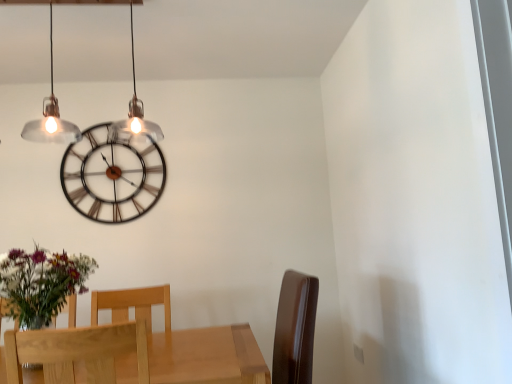
What are the coordinates of `free spot above metallic wire clock at upper center (from a real-world perspective)` in the screenshot? It's located at (117, 125).